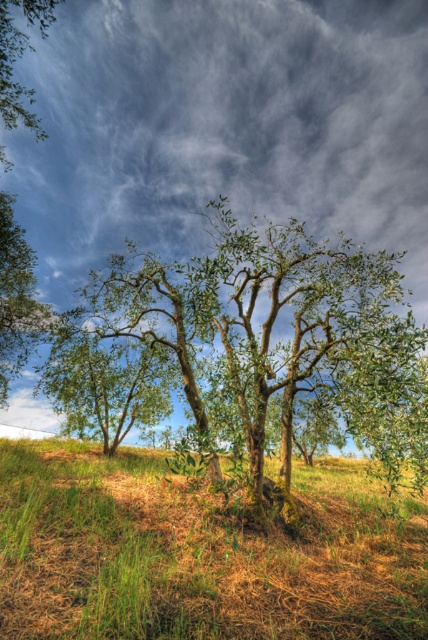
Is point (366, 408) positioned before point (20, 316)?

Yes.

Locate an element on the screen. This screenshot has width=428, height=640. green leafy tree at center is located at coordinates (273, 332).

Does point (262, 588) come closer to viewer compared to point (12, 17)?

That is True.

Between point (127, 525) and point (20, 310), which one is positioned behind?

The point (20, 310) is behind.

I want to click on green grass at lower left, so click(199, 554).

Is point (149, 529) farther from viewer compared to point (368, 348)?

No, it is in front of (368, 348).

Which is behind, point (297, 580) or point (202, 320)?

The point (202, 320) is more distant.

Find the location of `green grass at lower left`. green grass at lower left is located at coordinates (199, 554).